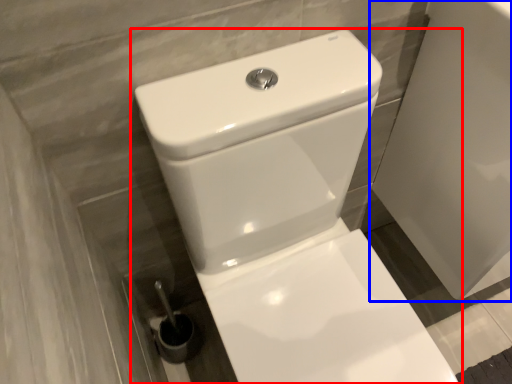
Question: Which object is closer to the camera taking this photo, toilet (highlighted by a red box) or porcelain (highlighted by a blue box)?

Choices:
 (A) toilet
 (B) porcelain

Answer: (A)